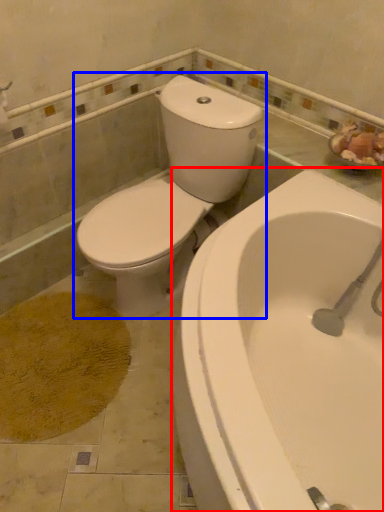
Question: Which object appears farthest to the camera in this image, bathtub (highlighted by a red box) or toilet (highlighted by a blue box)?

Choices:
 (A) bathtub
 (B) toilet

Answer: (B)